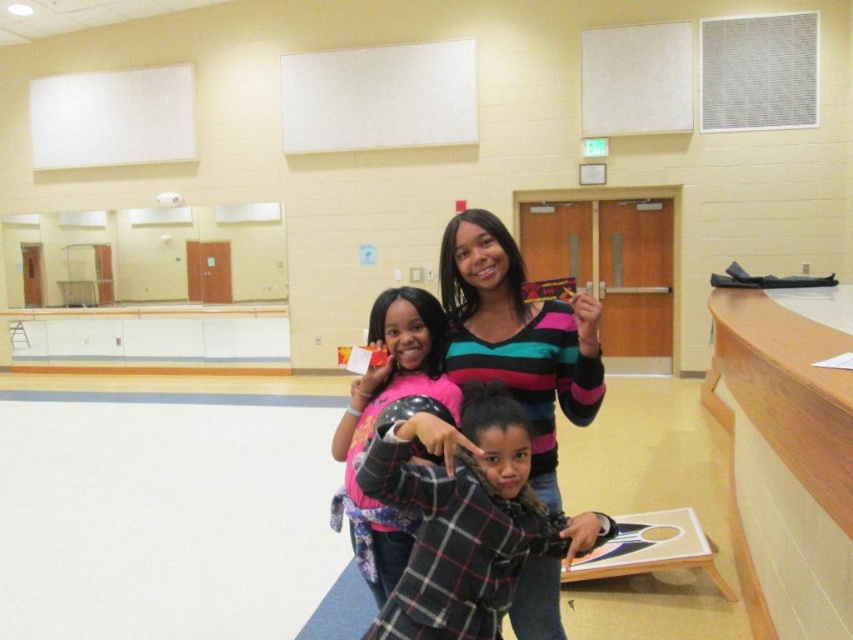
Which is below, plaid wool sweater at center or pink fabric shirt at center?

Positioned lower is plaid wool sweater at center.

In the scene shown: Is plaid wool sweater at center positioned at the back of pink fabric shirt at center?

No, it is in front of pink fabric shirt at center.

Is point (461, 525) closer to camera compared to point (352, 484)?

Yes, point (461, 525) is in front of point (352, 484).

The height and width of the screenshot is (640, 853). Identify the location of plaid wool sweater at center. (466, 516).

Between plaid wool sweater at center and striped sweater at center, which one is positioned higher?

striped sweater at center

Is plaid wool sweater at center thinner than striped sweater at center?

No, plaid wool sweater at center is not thinner than striped sweater at center.

You are a GUI agent. You are given a task and a screenshot of the screen. Output one action in this format:
    pyautogui.click(x=<x>, y=<y>)
    Task: Click on the plaid wool sweater at center
    
    Given the screenshot: What is the action you would take?
    pyautogui.click(x=466, y=516)

Identify the location of plaid wool sweater at center. (466, 516).

Does striped sweater at center appear on the right side of pink fabric shirt at center?

Indeed, striped sweater at center is positioned on the right side of pink fabric shirt at center.

In the scene shown: Does striped sweater at center appear over pink fabric shirt at center?

Yes.

Locate an element on the screen. This screenshot has width=853, height=640. striped sweater at center is located at coordinates (518, 337).